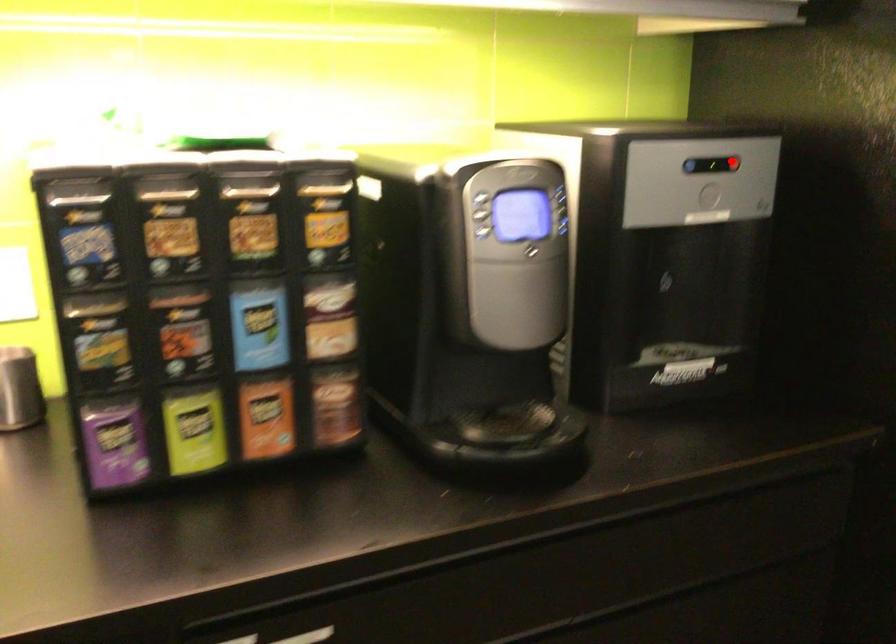
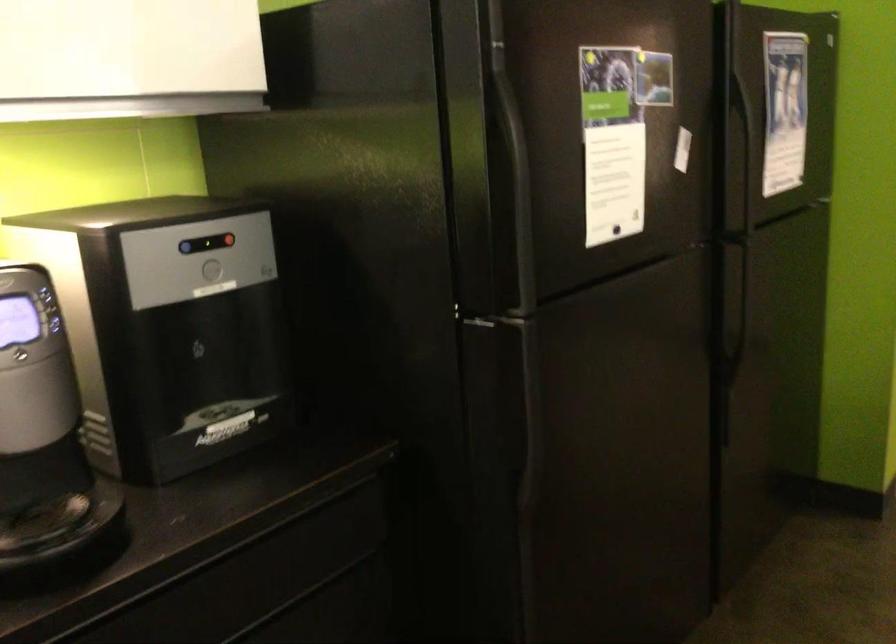
In the second image, find the point that corresponds to the highlighted location in the first image.

(227, 240)